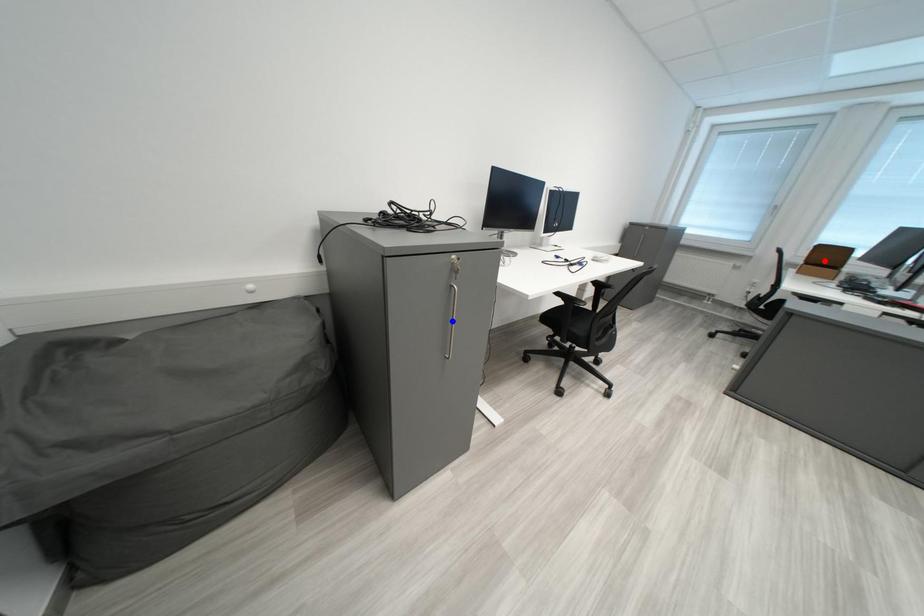
Question: Two points are marked on the image. Which point is closer to the camera?

Choices:
 (A) Blue point is closer.
 (B) Red point is closer.

Answer: (A)